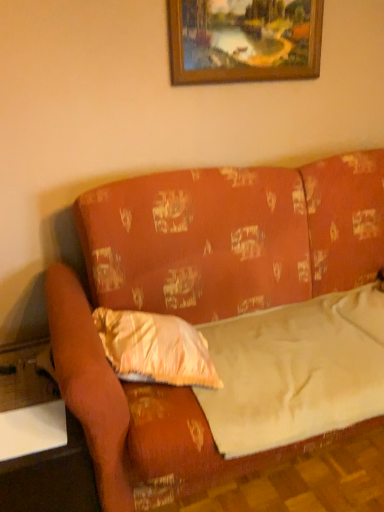
What is the approximate width of orange fabric couch at center?

orange fabric couch at center is 1.21 meters in width.

Image resolution: width=384 pixels, height=512 pixels. What do you see at coordinates (231, 237) in the screenshot?
I see `orange fabric couch at center` at bounding box center [231, 237].

This screenshot has height=512, width=384. What do you see at coordinates (296, 371) in the screenshot? I see `white fabric sheet at center` at bounding box center [296, 371].

Locate an element on the screen. shiny gold pillow at center-left is located at coordinates (155, 348).

Identify the location of orange fabric couch at center. The height and width of the screenshot is (512, 384). (231, 237).

Considering the relative positions of shiny gold pillow at center-left and wooden glossy table at lower left, the first table in the bottom-to-top sequence, in the image provided, is shiny gold pillow at center-left to the left of wooden glossy table at lower left, the first table in the bottom-to-top sequence, from the viewer's perspective?

No, shiny gold pillow at center-left is not to the left of wooden glossy table at lower left, the first table in the bottom-to-top sequence.

This screenshot has height=512, width=384. In order to click on table that is the 2nd object located below the shiny gold pillow at center-left (from the image's perspective) in this screenshot , I will do `click(51, 478)`.

Is shiny gold pillow at center-left with wooden glossy table at lower left, positioned as the second table in top-to-bottom order?

No, shiny gold pillow at center-left is not in contact with wooden glossy table at lower left, positioned as the second table in top-to-bottom order.

From their relative heights in the image, would you say shiny gold pillow at center-left is taller or shorter than wooden glossy table at lower left, positioned as the second table in top-to-bottom order?

shiny gold pillow at center-left is shorter than wooden glossy table at lower left, positioned as the second table in top-to-bottom order.

From a real-world perspective, who is located higher, wooden glossy table at lower left, the first table in the bottom-to-top sequence, or orange fabric couch at center?

orange fabric couch at center is physically above.

Between wooden glossy table at lower left, positioned as the second table in top-to-bottom order, and orange fabric couch at center, which one appears on the right side from the viewer's perspective?

orange fabric couch at center is more to the right.

At what (x,y) coordinates should I click in order to perform the action: click on studio couch that is on the right side of wooden glossy table at lower left, the first table in the bottom-to-top sequence. Please return your answer as a coordinate pair (x, y). The height and width of the screenshot is (512, 384). Looking at the image, I should click on (231, 237).

Between wooden glossy table at lower left, positioned as the second table in top-to-bottom order, and orange fabric couch at center, which one has less height?

wooden glossy table at lower left, positioned as the second table in top-to-bottom order.

Is white fabric sheet at center shorter than wooden glossy table at lower left, the first table in the bottom-to-top sequence?

Yes.

From the image's perspective, which is above, white fabric sheet at center or wooden glossy table at lower left, positioned as the second table in top-to-bottom order?

From the image's view, white fabric sheet at center is above.

From a real-world perspective, between white fabric sheet at center and wooden glossy table at lower left, the first table in the bottom-to-top sequence, who is vertically higher?

white fabric sheet at center is physically above.

How different are the orientations of white fabric sheet at center and wooden glossy table at lower left, the first table in the bottom-to-top sequence, in degrees?

The angle between the facing direction of white fabric sheet at center and the facing direction of wooden glossy table at lower left, the first table in the bottom-to-top sequence, is 0.45 degrees.

Can you confirm if wooden glossy table at lower left, the first table in the bottom-to-top sequence, is positioned to the left of shiny gold pillow at center-left?

Yes, wooden glossy table at lower left, the first table in the bottom-to-top sequence, is to the left of shiny gold pillow at center-left.

Consider the image. Considering the sizes of objects wooden glossy table at lower left, positioned as the second table in top-to-bottom order, and shiny gold pillow at center-left in the image provided, who is wider, wooden glossy table at lower left, positioned as the second table in top-to-bottom order, or shiny gold pillow at center-left?

wooden glossy table at lower left, positioned as the second table in top-to-bottom order, is wider.

Considering their positions, is wooden glossy table at lower left, positioned as the second table in top-to-bottom order, located in front of or behind shiny gold pillow at center-left?

Visually, wooden glossy table at lower left, positioned as the second table in top-to-bottom order, is located in front of shiny gold pillow at center-left.

Which of these two, wooden glossy table at lower left, positioned as the second table in top-to-bottom order, or shiny gold pillow at center-left, is bigger?

wooden glossy table at lower left, positioned as the second table in top-to-bottom order.

Is white fabric sheet at center facing away from white plastic table at lower left, arranged as the 2th table when ordered from the bottom?

white fabric sheet at center does not have its back to white plastic table at lower left, arranged as the 2th table when ordered from the bottom.

From a real-world perspective, who is located higher, white fabric sheet at center or white plastic table at lower left, arranged as the 2th table when ordered from the bottom?

In real-world perspective, white fabric sheet at center is above.

Could you measure the distance between white fabric sheet at center and white plastic table at lower left, which is counted as the first table, starting from the top?

A distance of 31.37 inches exists between white fabric sheet at center and white plastic table at lower left, which is counted as the first table, starting from the top.

From the image's perspective, which is below, white fabric sheet at center or white plastic table at lower left, which is counted as the first table, starting from the top?

white plastic table at lower left, which is counted as the first table, starting from the top, appears lower in the image.

Considering the points (35, 439) and (260, 75), which point is behind, point (35, 439) or point (260, 75)?

The point (260, 75) is more distant.

Is white plastic table at lower left, which is counted as the first table, starting from the top, facing towards wooden frame at upper center?

No, white plastic table at lower left, which is counted as the first table, starting from the top, is not facing towards wooden frame at upper center.

Considering the positions of objects white plastic table at lower left, arranged as the 2th table when ordered from the bottom, and wooden frame at upper center in the image provided, who is more to the left, white plastic table at lower left, arranged as the 2th table when ordered from the bottom, or wooden frame at upper center?

white plastic table at lower left, arranged as the 2th table when ordered from the bottom.

Is white plastic table at lower left, arranged as the 2th table when ordered from the bottom, not inside wooden frame at upper center?

Yes, white plastic table at lower left, arranged as the 2th table when ordered from the bottom, is outside of wooden frame at upper center.

From the image's perspective, relative to wooden frame at upper center, is white fabric sheet at center above or below?

From the image's perspective, white fabric sheet at center appears below wooden frame at upper center.

What's the angular difference between white fabric sheet at center and wooden frame at upper center's facing directions?

There is a 1.5-degree angle between the facing directions of white fabric sheet at center and wooden frame at upper center.

Considering their positions, is white fabric sheet at center located in front of or behind wooden frame at upper center?

white fabric sheet at center is in front of wooden frame at upper center.

From a real-world perspective, is white fabric sheet at center above or below wooden frame at upper center?

From a real-world perspective, white fabric sheet at center is physically below wooden frame at upper center.

Find the location of a particular element. pillow on the right side of wooden glossy table at lower left, the first table in the bottom-to-top sequence is located at coordinates (155, 348).

The image size is (384, 512). Identify the location of table that is the 1st object located behind the orange fabric couch at center. (51, 478).

From the image, which object appears to be farther from wooden glossy table at lower left, the first table in the bottom-to-top sequence, orange fabric couch at center or white fabric sheet at center?

white fabric sheet at center is positioned further to the anchor wooden glossy table at lower left, the first table in the bottom-to-top sequence.

When comparing their distances from white fabric sheet at center, does shiny gold pillow at center-left or wooden glossy table at lower left, the first table in the bottom-to-top sequence, seem closer?

shiny gold pillow at center-left is closer to white fabric sheet at center.

Estimate the real-world distances between objects in this image. Which object is closer to white plastic table at lower left, arranged as the 2th table when ordered from the bottom, wooden glossy table at lower left, positioned as the second table in top-to-bottom order, or shiny gold pillow at center-left?

wooden glossy table at lower left, positioned as the second table in top-to-bottom order, is closer to white plastic table at lower left, arranged as the 2th table when ordered from the bottom.

Based on their spatial positions, is wooden frame at upper center or orange fabric couch at center further from shiny gold pillow at center-left?

wooden frame at upper center is positioned further to the anchor shiny gold pillow at center-left.

Based on the photo, looking at the image, which one is located closer to orange fabric couch at center, shiny gold pillow at center-left or white fabric sheet at center?

shiny gold pillow at center-left is positioned closer to the anchor orange fabric couch at center.

Looking at the image, which one is located further to shiny gold pillow at center-left, white fabric sheet at center or orange fabric couch at center?

white fabric sheet at center lies further to shiny gold pillow at center-left than the other object.

Based on their spatial positions, is wooden glossy table at lower left, positioned as the second table in top-to-bottom order, or orange fabric couch at center closer to white fabric sheet at center?

Based on the image, orange fabric couch at center appears to be nearer to white fabric sheet at center.

From the image, which object appears to be farther from shiny gold pillow at center-left, wooden frame at upper center or white fabric sheet at center?

Among the two, wooden frame at upper center is located further to shiny gold pillow at center-left.

Locate an element on the screen. Image resolution: width=384 pixels, height=512 pixels. table between wooden frame at upper center and wooden glossy table at lower left, the first table in the bottom-to-top sequence, in the up-down direction is located at coordinates (32, 430).

At what (x,y) coordinates should I click in order to perform the action: click on pillow between wooden frame at upper center and white plastic table at lower left, which is counted as the first table, starting from the top, vertically. Please return your answer as a coordinate pair (x, y). Looking at the image, I should click on (155, 348).

Where is `pillow between wooden frame at upper center and white fabric sheet at center vertically`? pillow between wooden frame at upper center and white fabric sheet at center vertically is located at coordinates (155, 348).

Identify the location of table between wooden glossy table at lower left, the first table in the bottom-to-top sequence, and white fabric sheet at center. The image size is (384, 512). (32, 430).